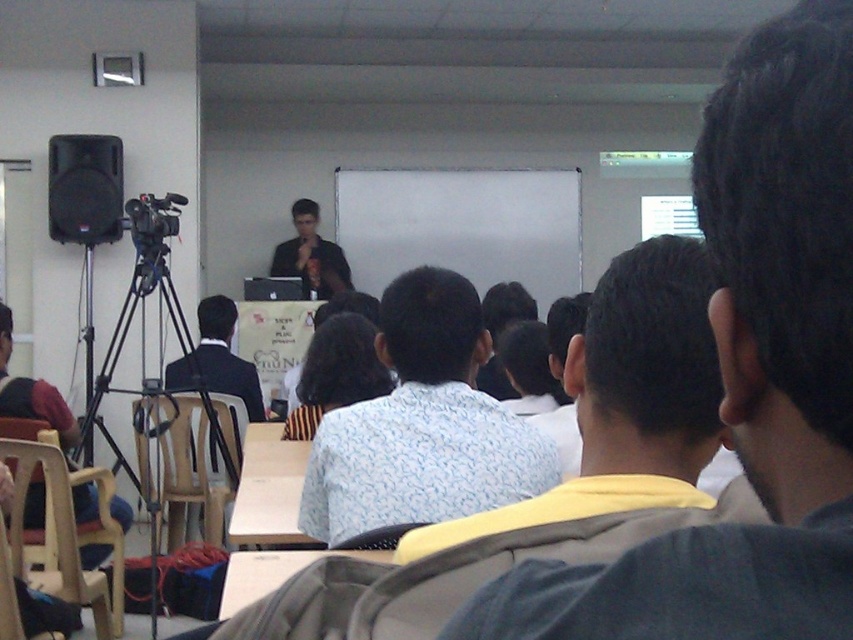
Is light brown plastic chair at lower left thinner than black matte speaker at left?

Yes.

Is point (105, 515) more distant than point (86, 150)?

No.

What do you see at coordinates (65, 529) in the screenshot? I see `light brown plastic chair at lower left` at bounding box center [65, 529].

This screenshot has height=640, width=853. Find the location of `light brown plastic chair at lower left`. light brown plastic chair at lower left is located at coordinates (65, 529).

Is plastic chair at left to the right of black matte speaker at left from the viewer's perspective?

Indeed, plastic chair at left is positioned on the right side of black matte speaker at left.

Image resolution: width=853 pixels, height=640 pixels. I want to click on plastic chair at left, so click(189, 470).

Does white patterned shirt at center appear under light blue patterned shirt at center?

Indeed, white patterned shirt at center is positioned under light blue patterned shirt at center.

Can you confirm if white patterned shirt at center is taller than light blue patterned shirt at center?

Yes, white patterned shirt at center is taller than light blue patterned shirt at center.

Is point (468, 349) in front of point (631, 397)?

No, it is behind (631, 397).

Locate an element on the screen. white patterned shirt at center is located at coordinates (422, 424).